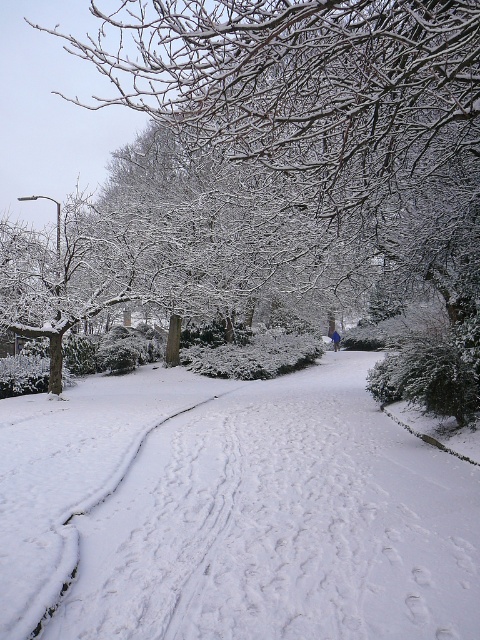
Question: Does white fluffy snow at center appear on the left side of snow-covered tree at left?

Choices:
 (A) yes
 (B) no

Answer: (B)

Question: Is white fluffy snow at center smaller than snow-covered tree at left?

Choices:
 (A) no
 (B) yes

Answer: (B)

Question: Which object appears closest to the camera in this image?

Choices:
 (A) white fluffy snow at center
 (B) snow-covered tree at left

Answer: (B)

Question: Can you confirm if white fluffy snow at center is bigger than snow-covered tree at left?

Choices:
 (A) no
 (B) yes

Answer: (A)